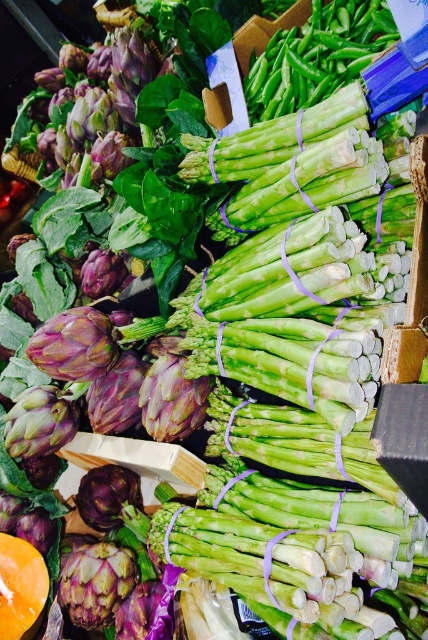
Measure the distance between point [104,625] and camera.

The distance of point [104,625] from camera is 1.20 meters.

Is purple matte artichoke at center-left positioned behind purple matte artichoke at center?

No, it is in front of purple matte artichoke at center.

Between point (77, 570) and point (142, 499), which one is positioned behind?

The point (142, 499) is more distant.

Where is `purple matte artichoke at center-left`? Image resolution: width=428 pixels, height=640 pixels. purple matte artichoke at center-left is located at coordinates (97, 582).